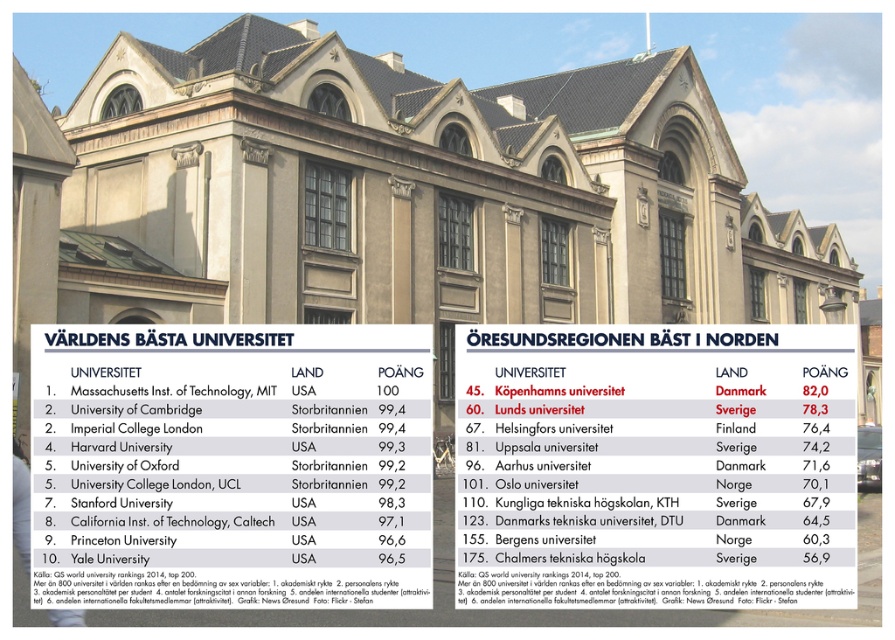
Can you confirm if white paper menu at upper left is wider than white paper menu at center?

No, white paper menu at upper left is not wider than white paper menu at center.

Between point (198, 429) and point (702, 422), which one is positioned behind?

Point (702, 422)

Locate an element on the screen. white paper menu at upper left is located at coordinates (232, 465).